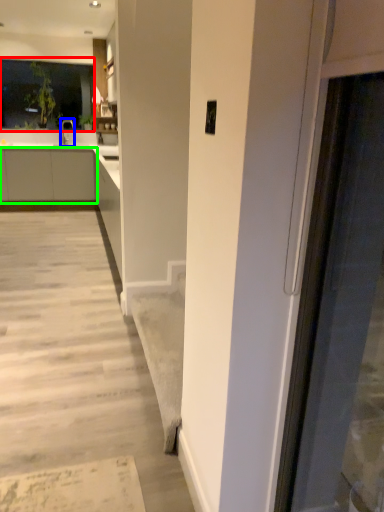
Question: Which is farther away from window (highlighted by a red box)? tap (highlighted by a blue box) or cabinetry (highlighted by a green box)?

Choices:
 (A) tap
 (B) cabinetry

Answer: (B)